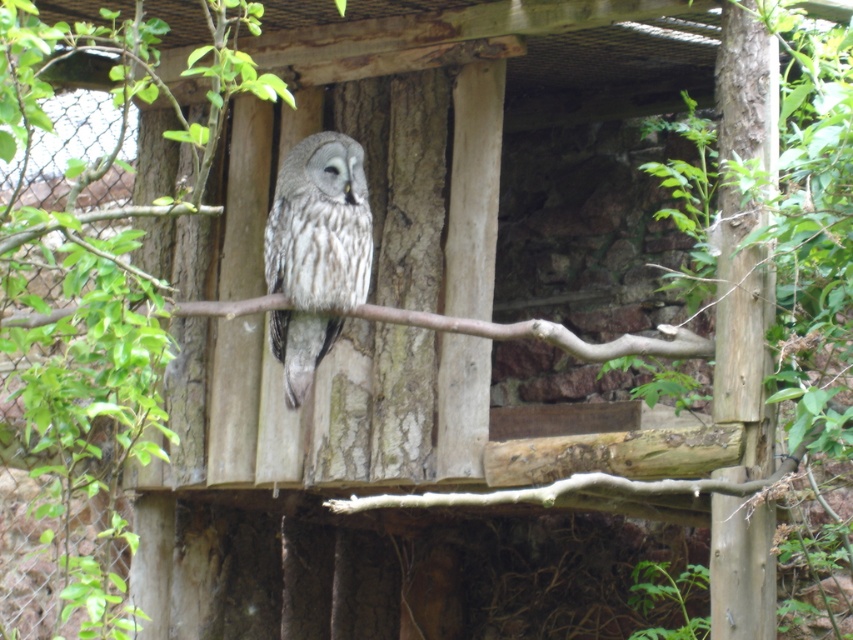
Question: Can you confirm if smooth brown wood at right is wider than speckled feathered owl at center?

Choices:
 (A) no
 (B) yes

Answer: (A)

Question: Does smooth brown wood at right lie behind speckled feathered owl at center?

Choices:
 (A) no
 (B) yes

Answer: (A)

Question: Which object appears closest to the camera in this image?

Choices:
 (A) smooth brown wood at right
 (B) speckled feathered owl at center

Answer: (A)

Question: Does smooth brown wood at right appear on the right side of speckled feathered owl at center?

Choices:
 (A) no
 (B) yes

Answer: (B)

Question: Which of the following is the closest to the observer?

Choices:
 (A) (321, 205)
 (B) (744, 100)

Answer: (B)

Question: Which point is farther from the camera taking this photo?

Choices:
 (A) (712, 371)
 (B) (299, 234)

Answer: (A)